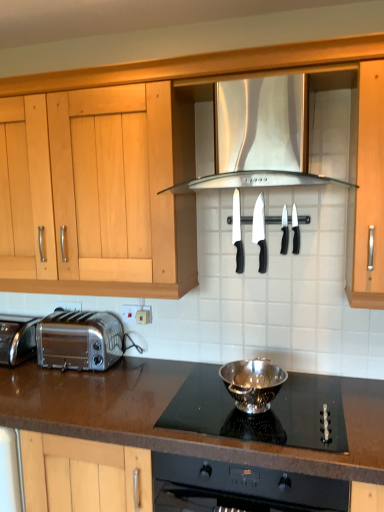
Describe the element at coordinates (250, 142) in the screenshot. This screenshot has width=384, height=512. I see `stainless steel exhaust hood at center` at that location.

The width and height of the screenshot is (384, 512). What are the coordinates of `black plastic knife at upper center, the 2th kitchen appliance in the front-to-back sequence` in the screenshot? It's located at (295, 230).

What are the coordinates of `polished stainless steel bowl at center` in the screenshot? It's located at (261, 413).

What is the approximate height of polished stainless steel bowl at center?

polished stainless steel bowl at center is 1.42 inches tall.

What are the coordinates of `brown granite countertop at lower center` in the screenshot? It's located at (176, 431).

I want to click on stainless steel exhaust hood at center, so click(250, 142).

In the scene shown: Considering the positions of objects polished stainless steel bowl at center and black plastic knife at upper center, the 2th kitchen appliance in the front-to-back sequence, in the image provided, who is behind, polished stainless steel bowl at center or black plastic knife at upper center, the 2th kitchen appliance in the front-to-back sequence,?

black plastic knife at upper center, the 2th kitchen appliance in the front-to-back sequence, is further from the camera.

Can you confirm if polished stainless steel bowl at center is smaller than black plastic knife at upper center, the 2th kitchen appliance in the front-to-back sequence?

Actually, polished stainless steel bowl at center might be larger than black plastic knife at upper center, the 2th kitchen appliance in the front-to-back sequence.

Is polished stainless steel bowl at center directly adjacent to black plastic knife at upper center, arranged as the fourth kitchen appliance when viewed from the back?

polished stainless steel bowl at center is not next to black plastic knife at upper center, arranged as the fourth kitchen appliance when viewed from the back, and they're not touching.

Would you say polished stainless steel bowl at center is to the left or to the right of black plastic knife at upper center, arranged as the fourth kitchen appliance when viewed from the back, in the picture?

Based on their positions, polished stainless steel bowl at center is located to the left of black plastic knife at upper center, arranged as the fourth kitchen appliance when viewed from the back.

Locate an element on the screen. This screenshot has height=512, width=384. the 2nd kitchen appliance positioned above the silver metallic bowl at center, the 5th kitchen appliance from the back (from a real-world perspective) is located at coordinates (237, 232).

Is silver metallic bowl at center, the 1th kitchen appliance in the front-to-back sequence, turned away from black plastic knife at center, positioned as the 1th kitchen appliance in back-to-front order?

silver metallic bowl at center, the 1th kitchen appliance in the front-to-back sequence, does not have its back to black plastic knife at center, positioned as the 1th kitchen appliance in back-to-front order.

Is silver metallic bowl at center, the 1th kitchen appliance in the front-to-back sequence, next to black plastic knife at center, the 5th kitchen appliance from the front, and touching it?

silver metallic bowl at center, the 1th kitchen appliance in the front-to-back sequence, and black plastic knife at center, the 5th kitchen appliance from the front, are clearly separated.

Considering the sizes of objects silver metallic bowl at center, the 1th kitchen appliance in the front-to-back sequence, and black plastic knife at center, the 5th kitchen appliance from the front, in the image provided, who is bigger, silver metallic bowl at center, the 1th kitchen appliance in the front-to-back sequence, or black plastic knife at center, the 5th kitchen appliance from the front,?

With larger size is silver metallic bowl at center, the 1th kitchen appliance in the front-to-back sequence.

How different are the orientations of stainless steel exhaust hood at center and polished chrome toaster at lower left in degrees?

0.194 degrees separate the facing orientations of stainless steel exhaust hood at center and polished chrome toaster at lower left.

Would you consider stainless steel exhaust hood at center to be distant from polished chrome toaster at lower left?

They are positioned close to each other.

Can you confirm if stainless steel exhaust hood at center is taller than polished chrome toaster at lower left?

Indeed, stainless steel exhaust hood at center has a greater height compared to polished chrome toaster at lower left.

Is stainless steel exhaust hood at center not inside polished chrome toaster at lower left?

stainless steel exhaust hood at center is positioned outside polished chrome toaster at lower left.

Is black plastic knife at upper center, arranged as the fourth kitchen appliance when viewed from the back, in contact with black plastic knife at center, positioned as the third kitchen appliance in front-to-back order?

Yes, black plastic knife at upper center, arranged as the fourth kitchen appliance when viewed from the back, is with black plastic knife at center, positioned as the third kitchen appliance in front-to-back order.

Which is more to the right, black plastic knife at upper center, arranged as the fourth kitchen appliance when viewed from the back, or black plastic knife at center, marked as the 3th kitchen appliance in a back-to-front arrangement?

black plastic knife at upper center, arranged as the fourth kitchen appliance when viewed from the back, is more to the right.

Between black plastic knife at upper center, the 2th kitchen appliance in the front-to-back sequence, and black plastic knife at center, positioned as the third kitchen appliance in front-to-back order, which one has smaller width?

Thinner between the two is black plastic knife at center, positioned as the third kitchen appliance in front-to-back order.

This screenshot has height=512, width=384. What are the coordinates of `the 1st kitchen appliance in front of the black plastic knife at center, positioned as the third kitchen appliance in front-to-back order` in the screenshot? It's located at (295, 230).

From the image's perspective, is black plastic knife at center, the 5th kitchen appliance from the front, on top of brown granite countertop at lower center?

Yes.

Are black plastic knife at center, positioned as the 1th kitchen appliance in back-to-front order, and brown granite countertop at lower center located far from each other?

That's not correct — black plastic knife at center, positioned as the 1th kitchen appliance in back-to-front order, is a little close to brown granite countertop at lower center.

In the scene shown: What's the angular difference between black plastic knife at center, positioned as the 1th kitchen appliance in back-to-front order, and brown granite countertop at lower center's facing directions?

They differ by 1.56 degrees in their facing directions.

Can you confirm if black plastic knife at center, positioned as the 1th kitchen appliance in back-to-front order, is wider than brown granite countertop at lower center?

Incorrect, the width of black plastic knife at center, positioned as the 1th kitchen appliance in back-to-front order, does not surpass that of brown granite countertop at lower center.

How many degrees apart are the facing directions of white plastic electric outlet at lower center and black plastic knife at center, positioned as the fourth kitchen appliance in front-to-back order?

0.362 degrees.

From a real-world perspective, is white plastic electric outlet at lower center on black plastic knife at center, positioned as the fourth kitchen appliance in front-to-back order?

No.

Measure the distance from white plastic electric outlet at lower center to black plastic knife at center, positioned as the fourth kitchen appliance in front-to-back order.

white plastic electric outlet at lower center is 60.32 centimeters away from black plastic knife at center, positioned as the fourth kitchen appliance in front-to-back order.

Looking at their sizes, would you say white plastic electric outlet at lower center is wider or thinner than black plastic knife at center, positioned as the fourth kitchen appliance in front-to-back order?

white plastic electric outlet at lower center is thinner than black plastic knife at center, positioned as the fourth kitchen appliance in front-to-back order.

Between black plastic knife at center, positioned as the 1th kitchen appliance in back-to-front order, and black plastic knife at center, positioned as the third kitchen appliance in front-to-back order, which one appears on the left side from the viewer's perspective?

black plastic knife at center, positioned as the 1th kitchen appliance in back-to-front order, is more to the left.

Are black plastic knife at center, positioned as the 1th kitchen appliance in back-to-front order, and black plastic knife at center, positioned as the third kitchen appliance in front-to-back order, making contact?

No.

Is black plastic knife at center, positioned as the 1th kitchen appliance in back-to-front order, turned away from black plastic knife at center, positioned as the third kitchen appliance in front-to-back order?

No.

From a real-world perspective, is black plastic knife at center, positioned as the 1th kitchen appliance in back-to-front order, located beneath black plastic knife at center, positioned as the third kitchen appliance in front-to-back order?

Correct, in the physical world, black plastic knife at center, positioned as the 1th kitchen appliance in back-to-front order, is lower than black plastic knife at center, positioned as the third kitchen appliance in front-to-back order.

From the image's perspective, starting from the polished stainless steel bowl at center, which kitchen appliance is the 4th one above? Please provide its 2D coordinates.

[(295, 230)]

Image resolution: width=384 pixels, height=512 pixels. Find the location of `the 1st kitchen appliance counting from the right of the black plastic knife at center, the 5th kitchen appliance from the front`. the 1st kitchen appliance counting from the right of the black plastic knife at center, the 5th kitchen appliance from the front is located at coordinates (253, 383).

Considering their positions, is silver metallic bowl at center, the 1th kitchen appliance in the front-to-back sequence, positioned closer to brown granite countertop at lower center than black plastic knife at upper center, the 2th kitchen appliance in the front-to-back sequence?

silver metallic bowl at center, the 1th kitchen appliance in the front-to-back sequence.

Based on the photo, from the image, which object appears to be nearer to black plastic knife at center, positioned as the fourth kitchen appliance in front-to-back order, black plastic knife at center, the 5th kitchen appliance from the front, or satin chrome toaster at lower left?

black plastic knife at center, the 5th kitchen appliance from the front, is positioned closer to the anchor black plastic knife at center, positioned as the fourth kitchen appliance in front-to-back order.

When comparing their distances from satin chrome toaster at lower left, does brown granite countertop at lower center or polished stainless steel bowl at center seem closer?

brown granite countertop at lower center is closer to satin chrome toaster at lower left.

When comparing their distances from black plastic knife at center, the second kitchen appliance viewed from the back, does black plastic knife at center, positioned as the third kitchen appliance in front-to-back order, or black plastic knife at center, positioned as the 1th kitchen appliance in back-to-front order, seem closer?

Based on the image, black plastic knife at center, positioned as the 1th kitchen appliance in back-to-front order, appears to be nearer to black plastic knife at center, the second kitchen appliance viewed from the back.

Consider the image. Estimate the real-world distances between objects in this image. Which object is further from black plastic knife at center, positioned as the 1th kitchen appliance in back-to-front order, black plastic knife at upper center, the 2th kitchen appliance in the front-to-back sequence, or stainless steel exhaust hood at center?

stainless steel exhaust hood at center lies further to black plastic knife at center, positioned as the 1th kitchen appliance in back-to-front order, than the other object.

From the image, which object appears to be nearer to polished chrome toaster at lower left, black plastic knife at center, positioned as the third kitchen appliance in front-to-back order, or silver metallic bowl at center, the 5th kitchen appliance from the back?

silver metallic bowl at center, the 5th kitchen appliance from the back, is closer to polished chrome toaster at lower left.

Looking at the image, which one is located closer to satin chrome toaster at lower left, black plastic knife at center, the 5th kitchen appliance from the front, or stainless steel exhaust hood at center?

black plastic knife at center, the 5th kitchen appliance from the front, is positioned closer to the anchor satin chrome toaster at lower left.

Estimate the real-world distances between objects in this image. Which object is further from black plastic knife at center, the second kitchen appliance viewed from the back, polished chrome toaster at lower left or silver metallic bowl at center, the 5th kitchen appliance from the back?

Based on the image, polished chrome toaster at lower left appears to be further to black plastic knife at center, the second kitchen appliance viewed from the back.

Identify the location of oven positioned between brown granite countertop at lower center and white plastic electric outlet at lower center from near to far. This screenshot has height=512, width=384. (17, 338).

You are a GUI agent. You are given a task and a screenshot of the screen. Output one action in this format:
    pyautogui.click(x=<x>, y=<y>)
    Task: Click on the electric outlet between stainless steel exhaust hood at center and polished chrome toaster at lower left in the vertical direction
    This screenshot has height=512, width=384.
    Given the screenshot: What is the action you would take?
    pyautogui.click(x=138, y=314)

At what (x,y) coordinates should I click in order to perform the action: click on kitchen appliance between black plastic knife at center, positioned as the 1th kitchen appliance in back-to-front order, and silver metallic bowl at center, the 5th kitchen appliance from the back, in the vertical direction. Please return your answer as a coordinate pair (x, y). This screenshot has width=384, height=512. Looking at the image, I should click on (260, 232).

This screenshot has width=384, height=512. What are the coordinates of `toaster that lies between black plastic knife at center, positioned as the 1th kitchen appliance in back-to-front order, and brown granite countertop at lower center from top to bottom` in the screenshot? It's located at (79, 340).